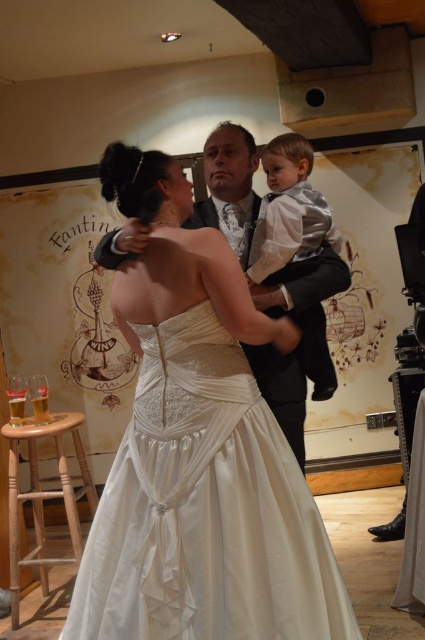
You are a photographer at the wedding reception. You need to position a silver textured suit at center and a light brown wooden stool at lower left in your shot. Which object is narrower in width?

The silver textured suit at center is narrower in width than the light brown wooden stool at lower left according to the description.